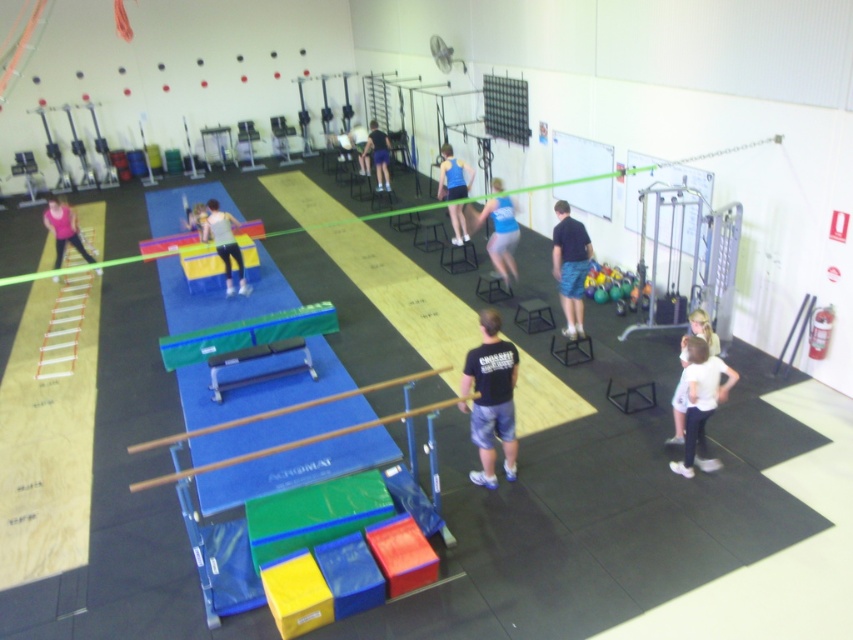
Question: Is black cotton t-shirt at center thinner than matte white shirt at center?

Choices:
 (A) no
 (B) yes

Answer: (B)

Question: Among these objects, which one is farthest from the camera?

Choices:
 (A) blue fabric tank top at center
 (B) blue fabric shorts at center

Answer: (A)

Question: Which point is farther from the camera taking this photo?

Choices:
 (A) (505, 252)
 (B) (55, 209)
 (C) (386, 168)

Answer: (C)

Question: From the image, what is the correct spatial relationship of black cotton t-shirt at center in relation to blue fabric tank top at center?

Choices:
 (A) above
 (B) below

Answer: (B)

Question: Which object is positioned farthest from the white cotton shirt at lower right?

Choices:
 (A) blue fabric tank top at center
 (B) black cotton t-shirt at center
 (C) matte blue shorts at center
 (D) matte white shirt at center

Answer: (C)

Question: Is white cotton shirt at lower right thinner than pink fabric shirt at left?

Choices:
 (A) yes
 (B) no

Answer: (B)